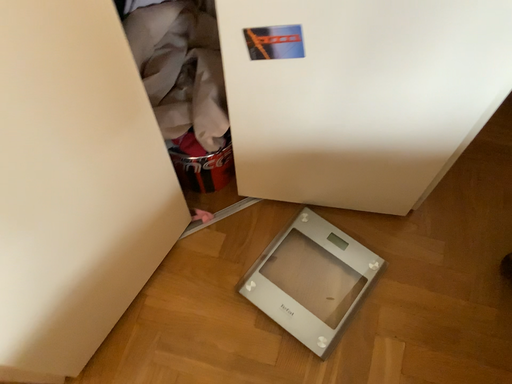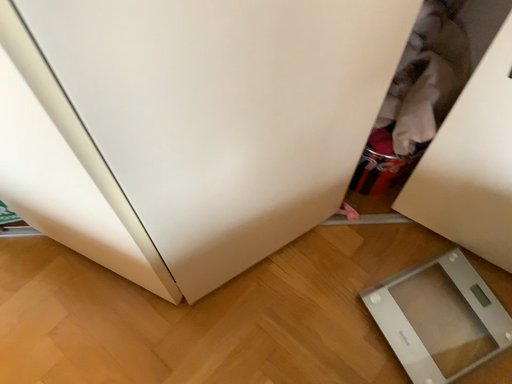
Question: Which way did the camera rotate in the video?

Choices:
 (A) rotated left
 (B) rotated right

Answer: (A)